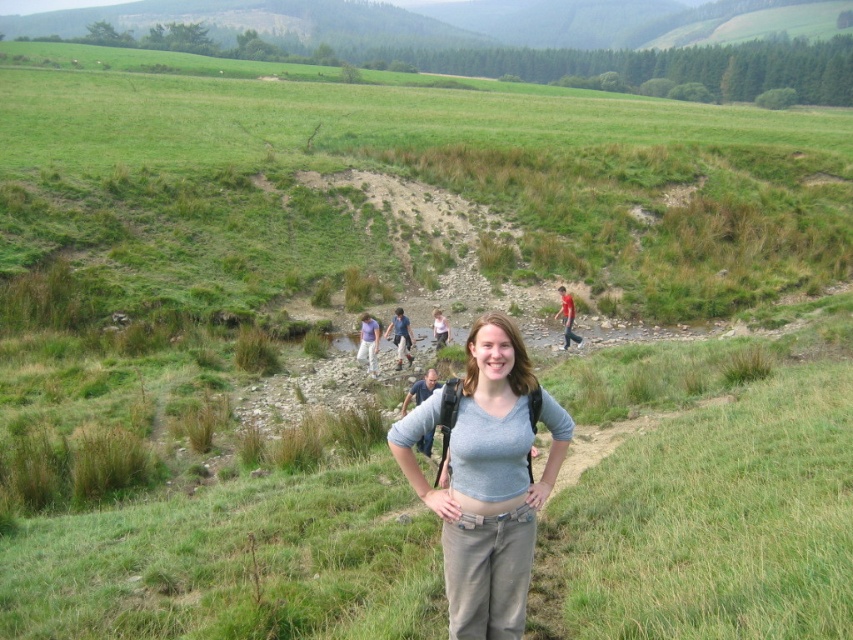
Question: Does gray matte shirt at center have a lesser width compared to blue denim jeans at center?

Choices:
 (A) yes
 (B) no

Answer: (B)

Question: Can you confirm if matte blue shirt at center is bigger than light pink fabric shirt at center?

Choices:
 (A) yes
 (B) no

Answer: (A)

Question: Can you confirm if blue denim jeans at center is wider than light pink fabric shirt at center?

Choices:
 (A) no
 (B) yes

Answer: (B)

Question: Which is farther from the gray matte shirt at center?

Choices:
 (A) light pink fabric shirt at center
 (B) blue denim jeans at center

Answer: (A)

Question: Which of these objects is positioned closest to the gray matte shirt at center?

Choices:
 (A) light pink fabric shirt at center
 (B) blue denim jeans at center
 (C) matte blue shirt at center
 (D) gray fabric backpack at center

Answer: (D)

Question: Which object is the closest to the light pink fabric shirt at center?

Choices:
 (A) matte blue shirt at center
 (B) red shirt at center
 (C) gray fabric backpack at center

Answer: (A)